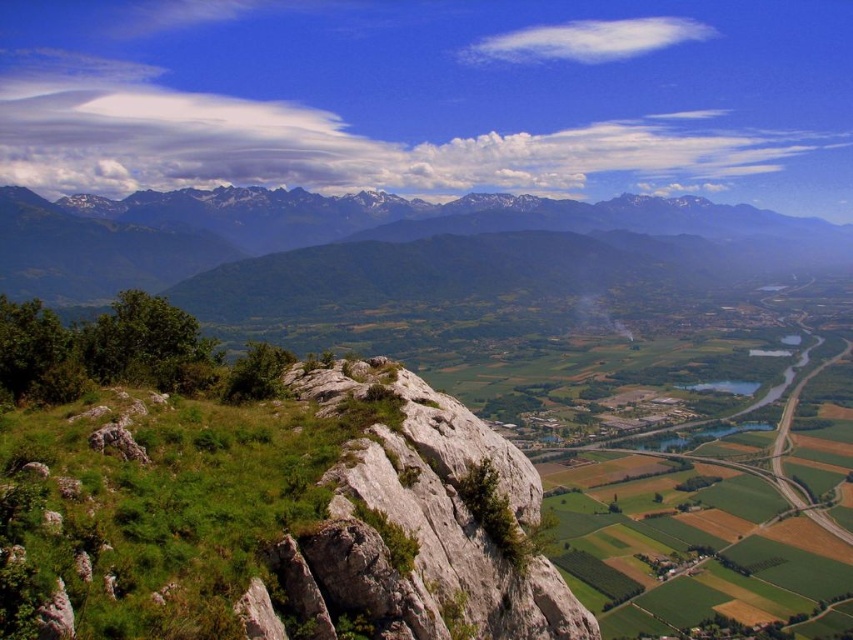
You are a hiker standing at the base of the valley and want to reach the gray rocky mountains at upper left. Which direction should you head towards from the green grassy rock at center?

The green grassy rock at center is below the gray rocky mountains at upper left, so you should head upwards from the green grassy rock at center towards the gray rocky mountains at upper left.

You are a hiker planning to take a photo of the majestic mountains in the background. You notice two points marked on your map at coordinates point [61,634] and point [55,244]. Which point should you choose to ensure the mountains are fully visible without any obstruction?

Point [61,634] is in front of point [55,244], so choosing point [55,244] will provide a better view of the mountains without obstruction.